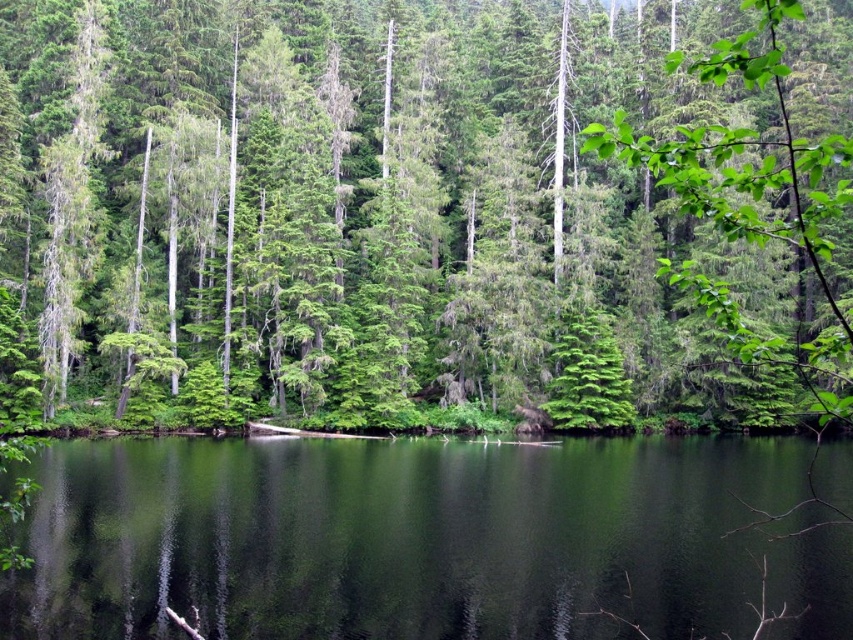
You are a hiker standing in the forest and notice both the green matte tree at center and the green reflective water at center. Which object appears larger in size?

The green matte tree at center is bigger than the green reflective water at center, so the green matte tree at center appears larger in size.

You are a photographer planning to capture the reflection of the green matte tree at center in the green reflective water at center. Based on their widths, which object would you focus on to ensure the reflection is fully captured?

The green matte tree at center is wider than the green reflective water at center, so focusing on the green reflective water at center would ensure the reflection is fully captured since the water needs to be wider than the tree to contain its reflection.

You are standing in the forest and want to take a photo of both the green matte tree at center and the green reflective water at center. Which object will appear larger in the photo?

The green matte tree at center will appear larger in the photo because it is much taller than the green reflective water at center.